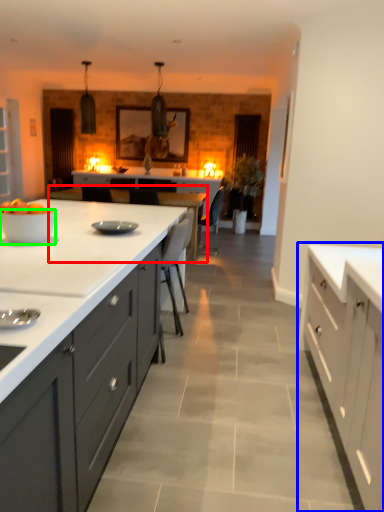
Question: Which is nearer to the table (highlighted by a red box)? cabinetry (highlighted by a blue box) or bowl (highlighted by a green box).

Choices:
 (A) cabinetry
 (B) bowl

Answer: (B)